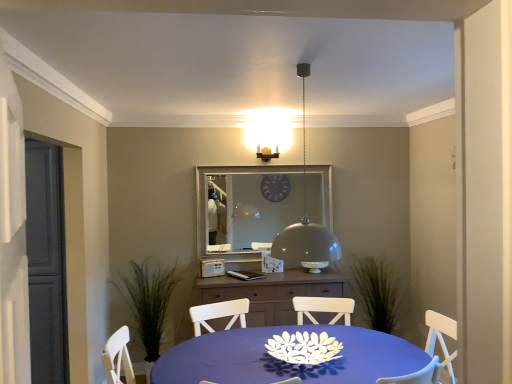
Question: From the image's perspective, is matte gray dome at center on top of silver metallic mirror at center?

Choices:
 (A) no
 (B) yes

Answer: (B)

Question: Is matte gray dome at center not near silver metallic mirror at center?

Choices:
 (A) yes
 (B) no

Answer: (A)

Question: Considering the relative positions of matte gray dome at center and silver metallic mirror at center in the image provided, is matte gray dome at center behind silver metallic mirror at center?

Choices:
 (A) yes
 (B) no

Answer: (B)

Question: From a real-world perspective, is matte gray dome at center on top of silver metallic mirror at center?

Choices:
 (A) no
 (B) yes

Answer: (B)

Question: Is matte gray dome at center bigger than silver metallic mirror at center?

Choices:
 (A) no
 (B) yes

Answer: (B)

Question: From a real-world perspective, is matte gray dome at center located beneath silver metallic mirror at center?

Choices:
 (A) no
 (B) yes

Answer: (A)

Question: From the image's perspective, is silver metallic mirror at center above matte brown cabinet at center?

Choices:
 (A) no
 (B) yes

Answer: (B)

Question: From a real-world perspective, is silver metallic mirror at center positioned under matte brown cabinet at center based on gravity?

Choices:
 (A) no
 (B) yes

Answer: (A)

Question: Are silver metallic mirror at center and matte brown cabinet at center making contact?

Choices:
 (A) yes
 (B) no

Answer: (B)

Question: Does silver metallic mirror at center have a larger size compared to matte brown cabinet at center?

Choices:
 (A) no
 (B) yes

Answer: (A)

Question: Is silver metallic mirror at center not within matte brown cabinet at center?

Choices:
 (A) no
 (B) yes

Answer: (B)

Question: Considering the relative sizes of silver metallic mirror at center and matte brown cabinet at center in the image provided, is silver metallic mirror at center wider than matte brown cabinet at center?

Choices:
 (A) yes
 (B) no

Answer: (B)

Question: From a real-world perspective, does white paper flower at center stand above matte brown cabinet at center?

Choices:
 (A) yes
 (B) no

Answer: (A)